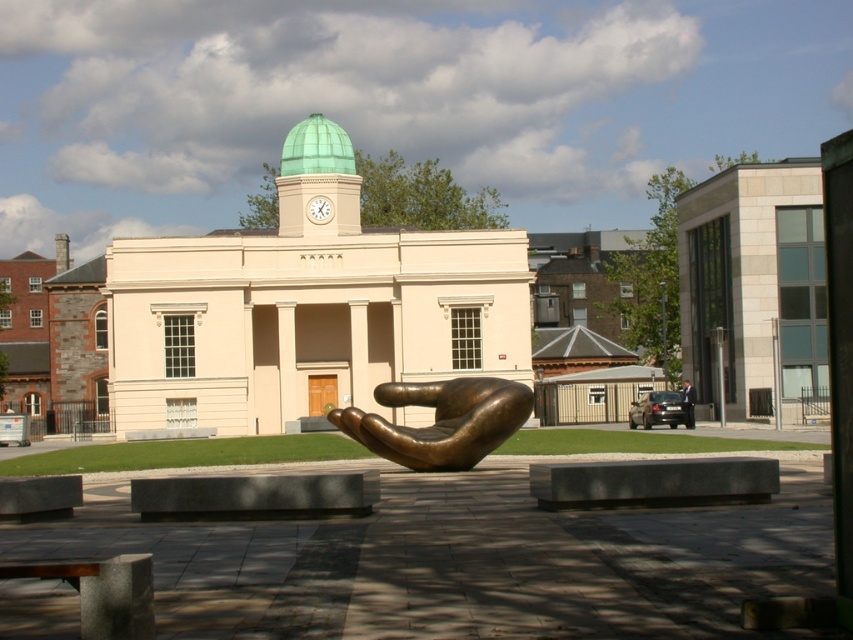
Consider the image. Does bronze hand at center appear on the left side of dark suit at center?

Correct, you'll find bronze hand at center to the left of dark suit at center.

The height and width of the screenshot is (640, 853). I want to click on bronze hand at center, so click(x=440, y=420).

Locate an element on the screen. The image size is (853, 640). bronze hand at center is located at coordinates (440, 420).